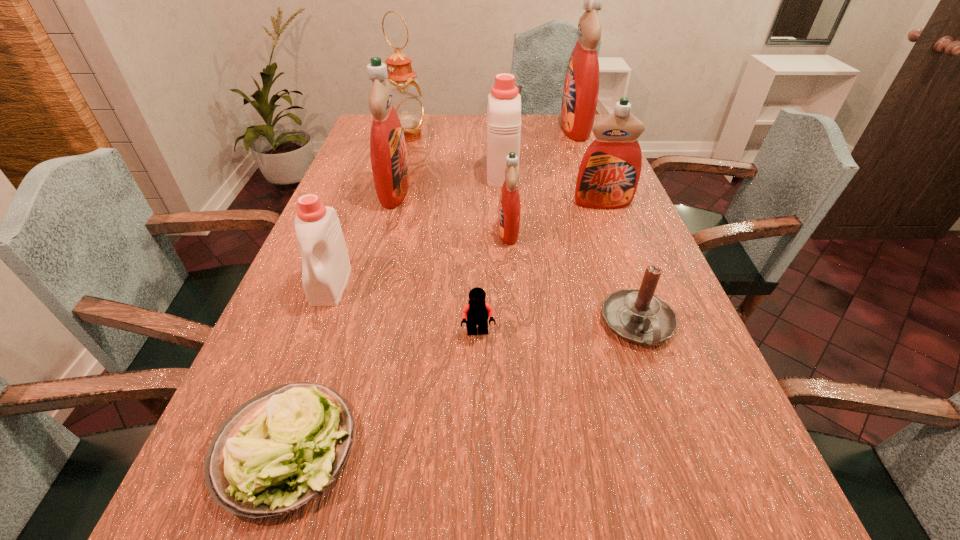
The height and width of the screenshot is (540, 960). In order to click on vacant space situated 0.050m on the side of the candle with the handle loop in this screenshot , I will do `click(658, 379)`.

Locate an element on the screen. vacant space situated 0.360m on the front-facing side of the black Lego is located at coordinates (477, 537).

Where is `free region located 0.150m on the back of the green lettuce`? The width and height of the screenshot is (960, 540). free region located 0.150m on the back of the green lettuce is located at coordinates (327, 328).

Where is `detergent situated at the far edge`? This screenshot has height=540, width=960. detergent situated at the far edge is located at coordinates (581, 87).

Where is `oil lamp that is at the far edge`? Image resolution: width=960 pixels, height=540 pixels. oil lamp that is at the far edge is located at coordinates (406, 99).

The image size is (960, 540). Find the location of `oil lamp situated at the left edge`. oil lamp situated at the left edge is located at coordinates tap(406, 99).

Where is `lettuce at the left edge`? The height and width of the screenshot is (540, 960). lettuce at the left edge is located at coordinates pos(277,451).

Locate an element on the screen. This screenshot has width=960, height=540. candle at the right edge is located at coordinates (637, 315).

Locate an element on the screen. object present at the far left corner is located at coordinates (406, 99).

You are a GUI agent. You are given a task and a screenshot of the screen. Output one action in this format:
    pyautogui.click(x=<x>, y=<y>)
    Task: Click on the object present at the far right corner
    This screenshot has height=540, width=960.
    Given the screenshot: What is the action you would take?
    581,87